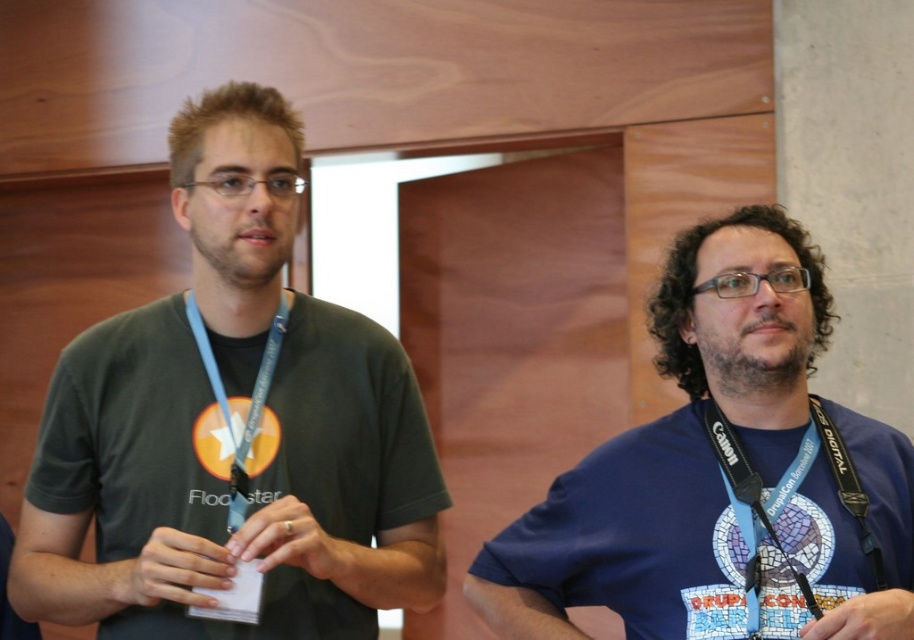
You are a photographer setting up for a group photo at the event. You have two points marked on your camera screen, point A at coordinates point (337, 404) and point B at coordinates point (202, 275). Which point is closer to the camera lens?

Point A at coordinates point (337, 404) is closer to the camera lens because it is further to the viewer than point B at coordinates point (202, 275).

You are a photographer at the event and need to position the two participants so that their heights are balanced in the photo. Given the blue fabric shirt at right and the matte green neck at center, which participant should you move forward to appear shorter?

The blue fabric shirt at right is much taller than the matte green neck at center. To balance their heights in the photo, move the blue fabric shirt at right forward so it appears shorter.